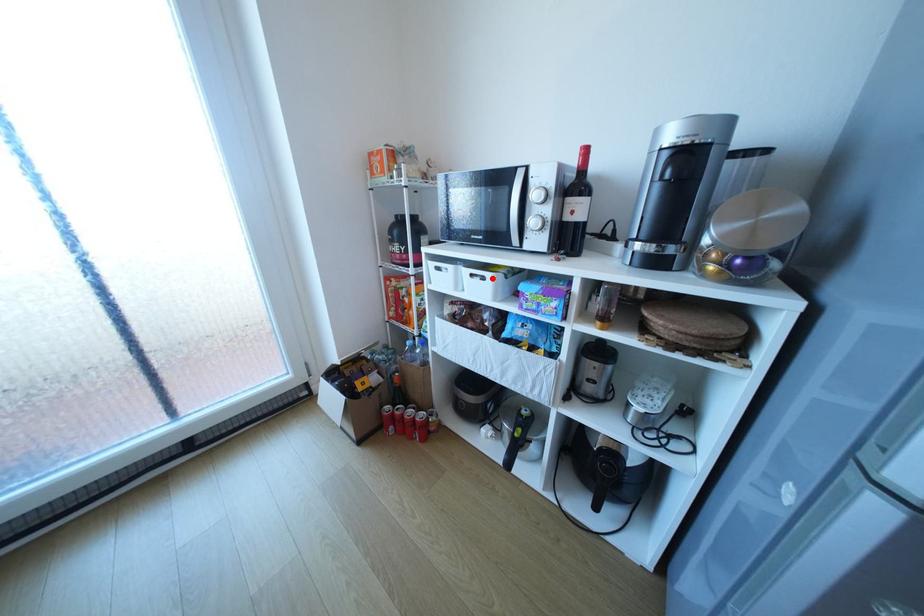
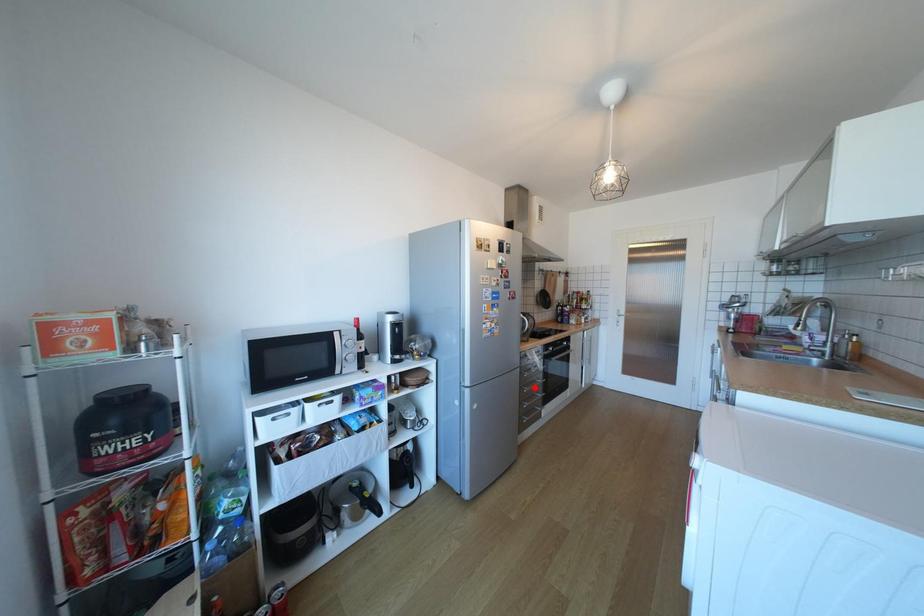
I am providing you with two images of the same scene from different viewpoints. A red point is marked on the first image and another point is marked on the second image. Are the points marked in image1 and image2 representing the same 3D position?

No